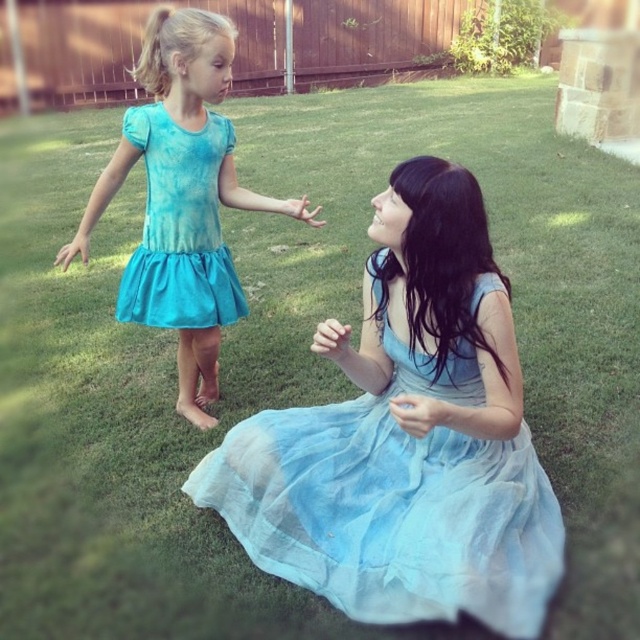
Question: In this image, where is light blue sheer dress at center located relative to tie-dye fabric dress at left?

Choices:
 (A) right
 (B) left

Answer: (A)

Question: Is light blue sheer dress at center further to camera compared to tie-dye fabric dress at left?

Choices:
 (A) no
 (B) yes

Answer: (A)

Question: Among these objects, which one is farthest from the camera?

Choices:
 (A) light blue sheer dress at center
 (B) tie-dye fabric dress at left
 (C) turquoise fabric dress at left

Answer: (B)

Question: Which object is the farthest from the tie-dye fabric dress at left?

Choices:
 (A) light blue sheer dress at center
 (B) turquoise fabric dress at left

Answer: (A)

Question: Is turquoise fabric dress at left to the left of tie-dye fabric dress at left from the viewer's perspective?

Choices:
 (A) yes
 (B) no

Answer: (A)

Question: Among these points, which one is nearest to the camera?

Choices:
 (A) (476, 444)
 (B) (150, 256)
 (C) (150, 244)

Answer: (A)